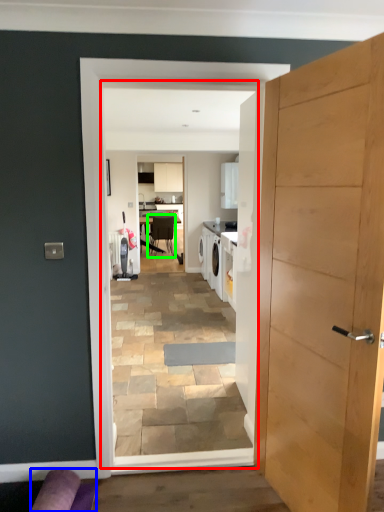
Question: Which object is positioned closest to residence (highlighted by a red box)? Select from couch (highlighted by a blue box) and chair (highlighted by a green box).

Choices:
 (A) couch
 (B) chair

Answer: (A)